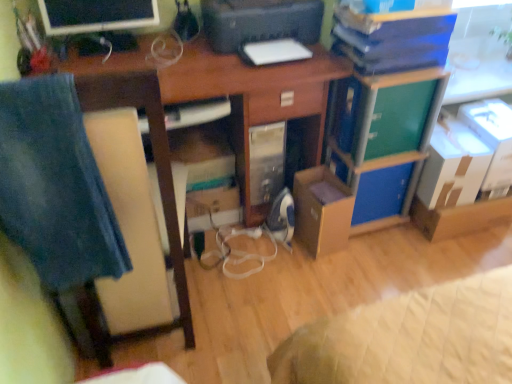
The image size is (512, 384). I want to click on empty space that is to the right of wooden chair at left, so click(x=267, y=310).